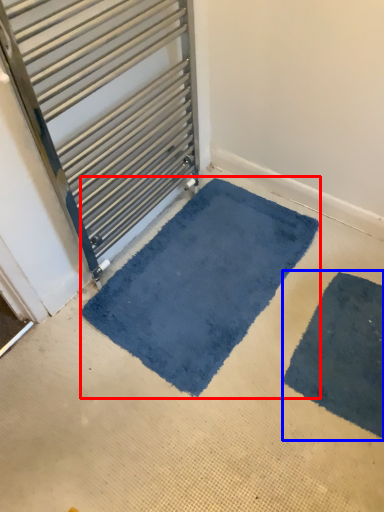
Question: Which point is further to the camera, mat (highlighted by a red box) or bath mat (highlighted by a blue box)?

Choices:
 (A) mat
 (B) bath mat

Answer: (A)